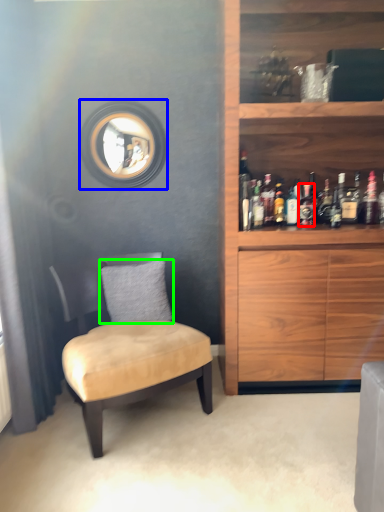
Question: Estimate the real-world distances between objects in this image. Which object is farther from bottle (highlighted by a red box), mirror (highlighted by a blue box) or pillow (highlighted by a green box)?

Choices:
 (A) mirror
 (B) pillow

Answer: (A)